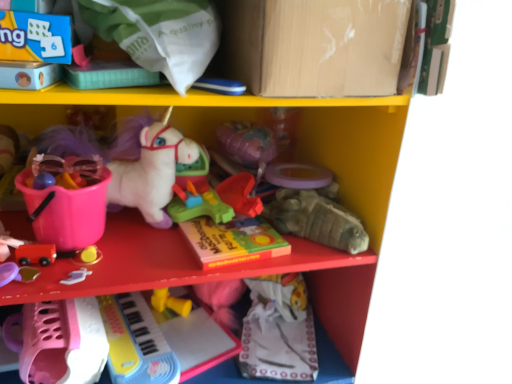
You are a GUI agent. You are given a task and a screenshot of the screen. Output one action in this format:
    pyautogui.click(x=<x>, y=<y>)
    Task: Click on the vacant area located to the right-hand side of yellow rubber toy at lower center, which is counted as the 5th toy, starting from the top
    The height and width of the screenshot is (384, 512).
    Given the screenshot: What is the action you would take?
    pyautogui.click(x=209, y=321)